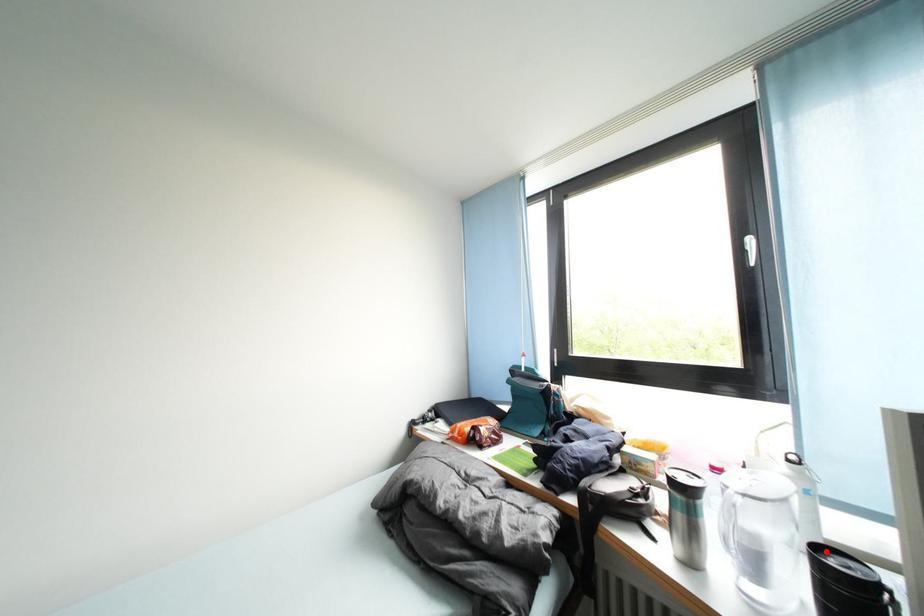
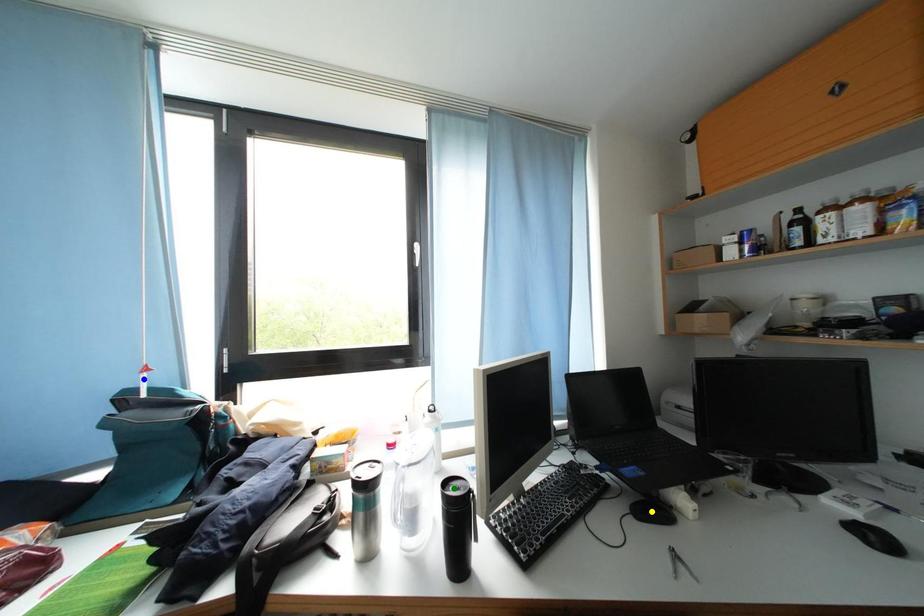
Question: I am providing you with two images of the same scene from different viewpoints. A red point is marked on the first image. You are given multiple points on the second image. Which mark in image 2 goes with the point in image 1?

Choices:
 (A) yellow point
 (B) green point
 (C) blue point

Answer: (B)